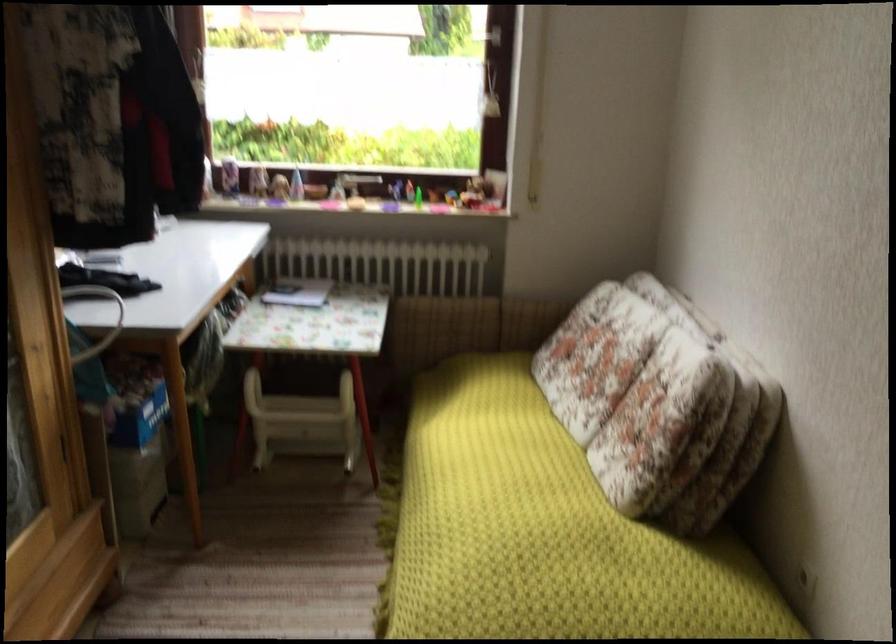
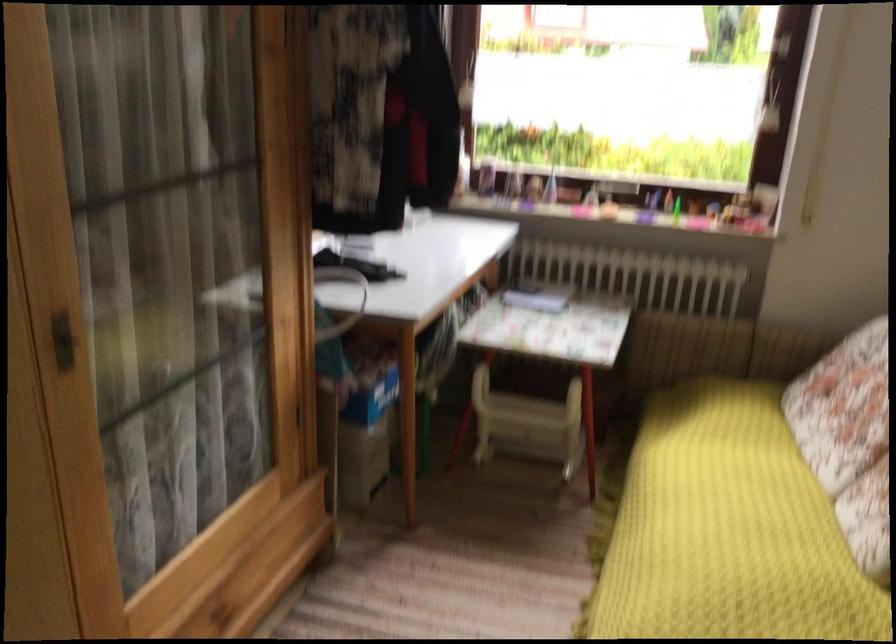
In the second image, find the point that corresponds to (x=126, y=404) in the first image.

(360, 381)